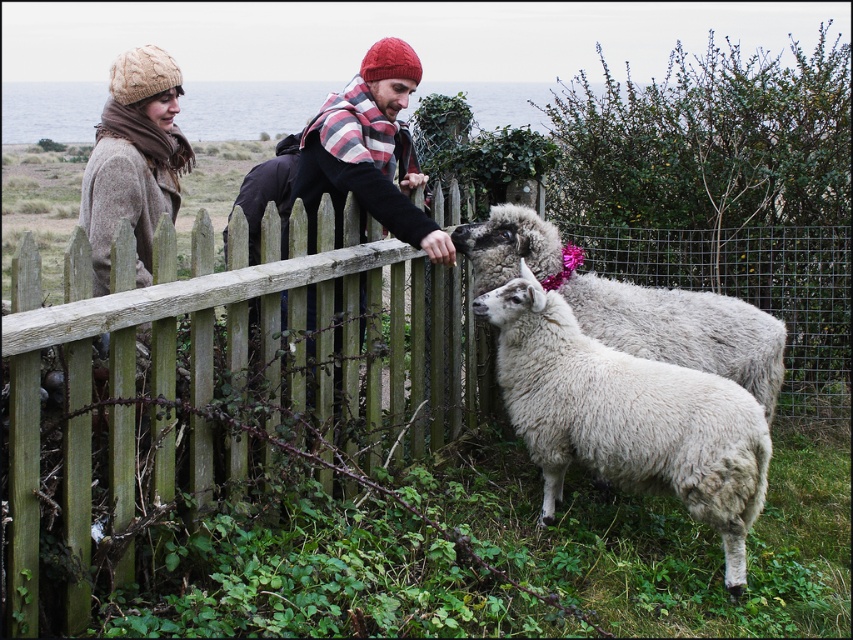
Question: Does wooden fence at center come behind white woolen sheep at center?

Choices:
 (A) no
 (B) yes

Answer: (A)

Question: Can you confirm if white woolen sheep at center is smaller than plaid wool scarf at center?

Choices:
 (A) no
 (B) yes

Answer: (B)

Question: Which point is farther to the camera?

Choices:
 (A) (299, 173)
 (B) (114, 106)
 (C) (546, 228)

Answer: (B)

Question: Which point is closer to the camera taking this photo?

Choices:
 (A) (334, 193)
 (B) (148, 244)
 (C) (575, 380)

Answer: (C)

Question: Which point is farther to the camera?

Choices:
 (A) (554, 369)
 (B) (403, 157)
 (C) (107, 493)

Answer: (B)

Question: Can you confirm if plaid wool scarf at center is thinner than knitted beige hat at upper left?

Choices:
 (A) yes
 (B) no

Answer: (B)